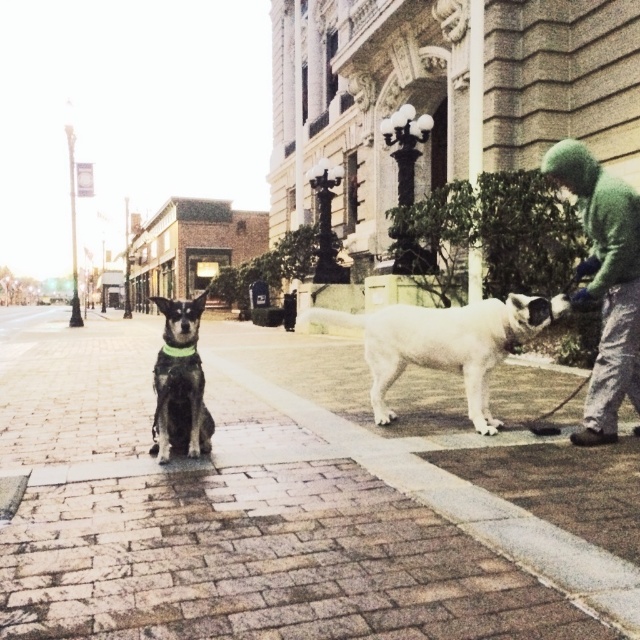
Looking at this image, you are a photographer trying to capture a photo of the shiny black dog at center and the green fabric neckband at center. If you want to ensure both are fully visible in the frame, which object should you adjust your focus to prioritize in terms of size?

The shiny black dog at center is wider than the green fabric neckband at center. To ensure both are fully visible, prioritize focusing on the shiny black dog at center since it requires more space in the frame.

You are a photographer standing in front of the ornate building. You want to take a photo of the green fuzzy sweater at right and the shiny black dog at center. Which object should you zoom in on to capture more details of its texture?

The green fuzzy sweater at right has a greater height compared to the shiny black dog at center, so you should zoom in on the green fuzzy sweater at right to capture more details of its texture.

Based on the scene description, what are the coordinates of the shiny black dog at center?

The coordinates of the shiny black dog at center are at point (179, 408).